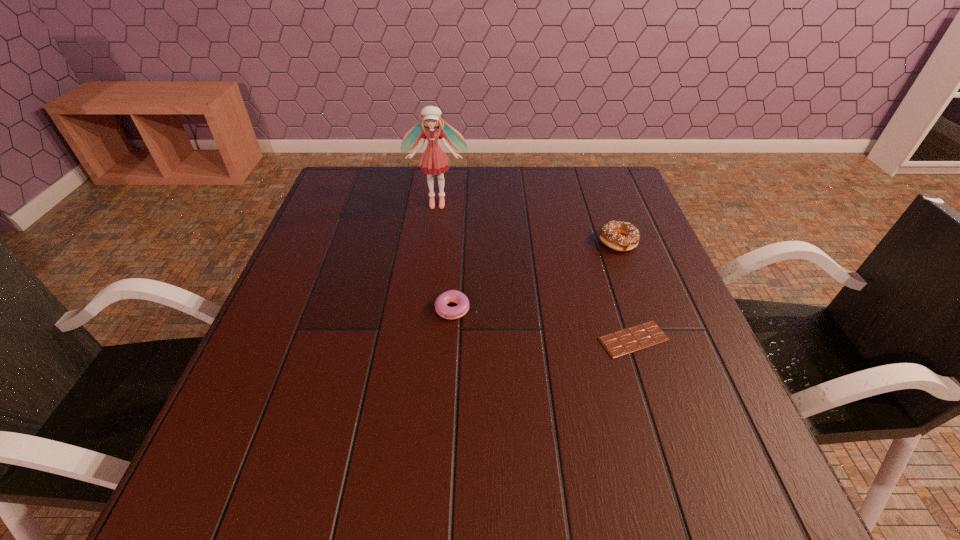
Find the location of a particular element. This screenshot has width=960, height=540. free space located on the front of the chocolate bar is located at coordinates (690, 516).

Find the location of a particular element. This screenshot has height=540, width=960. object positioned at the far edge is located at coordinates (434, 160).

Identify the location of doughnut that is positioned at the right edge. Image resolution: width=960 pixels, height=540 pixels. (621, 236).

I want to click on chocolate bar at the right edge, so click(x=619, y=343).

In the image, there is a desktop. Where is `vacant region at the far edge`? This screenshot has width=960, height=540. vacant region at the far edge is located at coordinates (477, 201).

Locate an element on the screen. This screenshot has width=960, height=540. free space at the near edge of the desktop is located at coordinates (531, 505).

Image resolution: width=960 pixels, height=540 pixels. What are the coordinates of `free space at the left edge of the desktop` in the screenshot? It's located at (294, 287).

At what (x,y) coordinates should I click in order to perform the action: click on free location at the right edge of the desktop. Please return your answer as a coordinate pair (x, y). Looking at the image, I should click on (628, 288).

The height and width of the screenshot is (540, 960). I want to click on free space at the far left corner of the desktop, so click(x=339, y=184).

Locate an element on the screen. empty location between the doll and the taller doughnut is located at coordinates (528, 222).